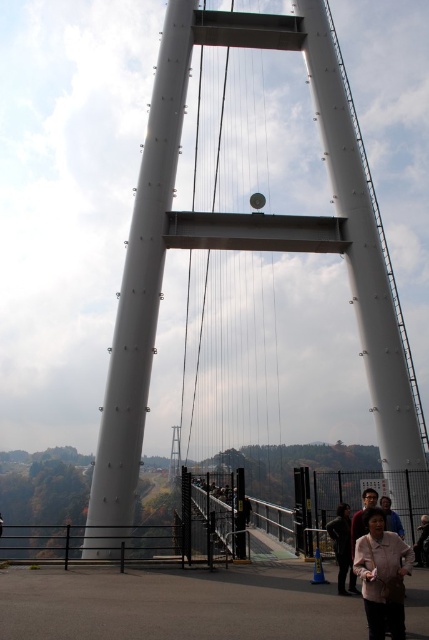
You are standing on the white metallic suspension bridge at center and want to take a photo of the dark brown leather jacket at lower right. Which object should you point your camera towards to include both in the frame?

Since the white metallic suspension bridge at center is much taller than the dark brown leather jacket at lower right, you should point your camera towards the lower right to capture both the bridge and the jacket in the frame.

From the picture: You are standing on the white metallic suspension bridge at center and want to walk to the dark brown leather jacket at lower right. Since the bridge is wider than the jacket, can you safely step off the bridge onto the jacket?

The white metallic suspension bridge at center is wider than the dark brown leather jacket at lower right, so stepping off the bridge onto the jacket is possible but not advisable due to the jacket being smaller and likely unstable as a landing surface.